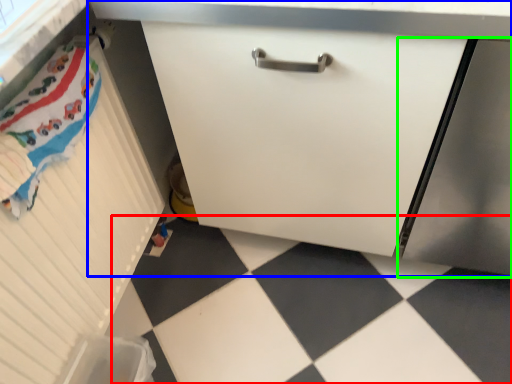
Question: Which object is positioned farthest from tile (highlighted by a red box)? Select from cabinetry (highlighted by a blue box) and screen door (highlighted by a green box).

Choices:
 (A) cabinetry
 (B) screen door

Answer: (B)